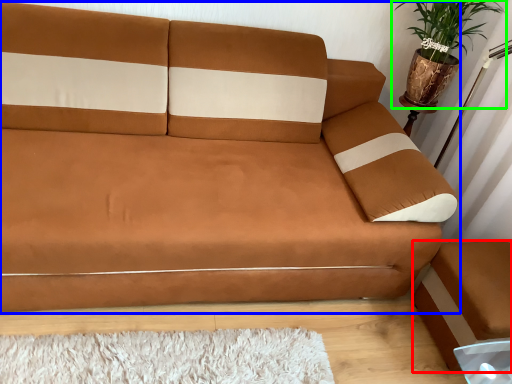
Question: Which is farther away from footrest (highlighted by a red box)? studio couch (highlighted by a blue box) or houseplant (highlighted by a green box)?

Choices:
 (A) studio couch
 (B) houseplant

Answer: (B)